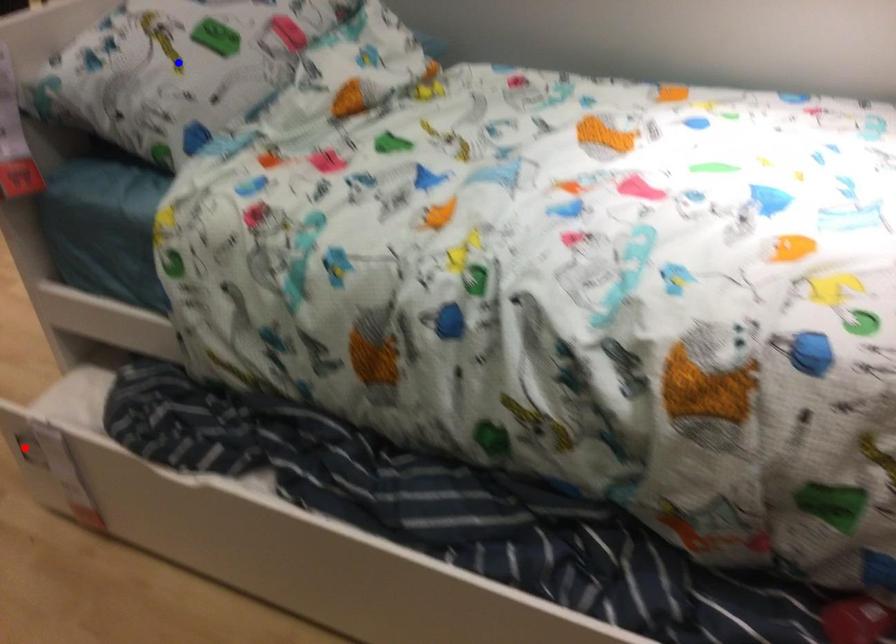
Question: Two points are marked on the image. Which point is closer to the camera?

Choices:
 (A) Blue point is closer.
 (B) Red point is closer.

Answer: (A)